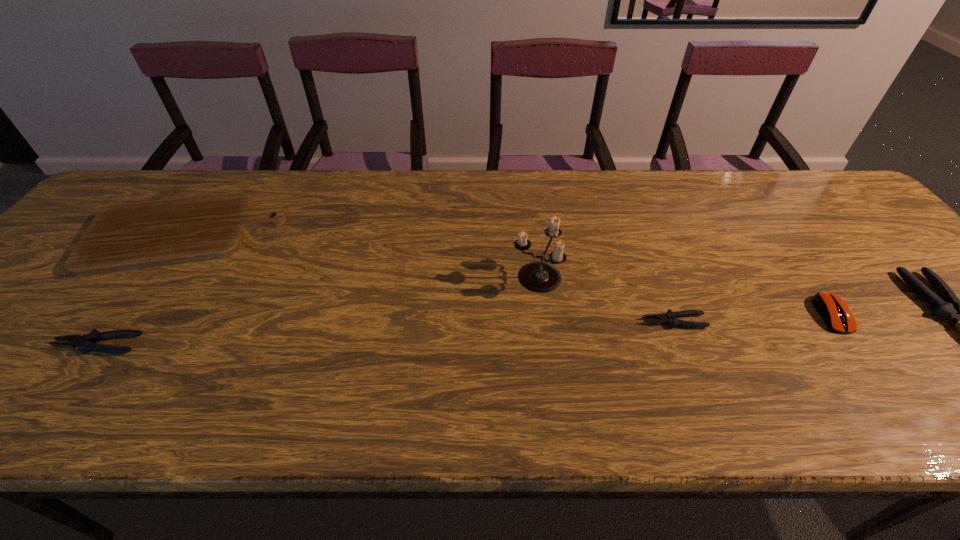
Find the location of a particular element. Image resolution: width=960 pixels, height=540 pixels. vacant area situated at the gripping part of the shortest object is located at coordinates (588, 321).

Where is `vacant space situated 0.050m on the back of the chopping board`? vacant space situated 0.050m on the back of the chopping board is located at coordinates (217, 187).

The width and height of the screenshot is (960, 540). Find the location of `free space located on the front of the tallest object`. free space located on the front of the tallest object is located at coordinates (544, 346).

Identify the location of vacant space located on the back of the computer mouse. (774, 234).

Locate an element on the screen. This screenshot has height=540, width=960. object that is at the far edge is located at coordinates (129, 236).

Identify the location of object at the near edge. This screenshot has height=540, width=960. (85, 343).

You are a GUI agent. You are given a task and a screenshot of the screen. Output one action in this format:
    pyautogui.click(x=<x>, y=<y>)
    Task: Click on the object that is at the left edge
    This screenshot has height=540, width=960.
    Given the screenshot: What is the action you would take?
    [129, 236]

Find the location of a particular element. This screenshot has width=960, height=540. object present at the far left corner is located at coordinates (129, 236).

This screenshot has height=540, width=960. Find the location of `vacant point at the far edge`. vacant point at the far edge is located at coordinates point(509,178).

What are the coordinates of `vacant space at the near edge of the desktop` in the screenshot? It's located at (338, 376).